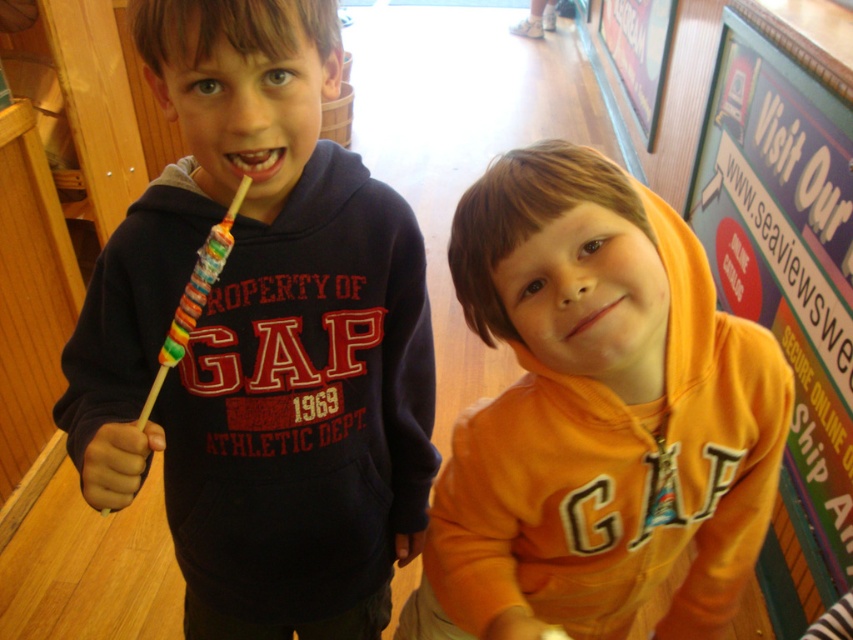
What are the coordinates of the matte black hoodie at center?

The matte black hoodie at center is located at coordinates point (x=262, y=339).

You are a parent trying to choose a lollipop for your child. You have two options in the image, the rainbow candy lollipop at left and the smooth plastic lollipop at center. Which one is wider?

The rainbow candy lollipop at left is wider than the smooth plastic lollipop at center.